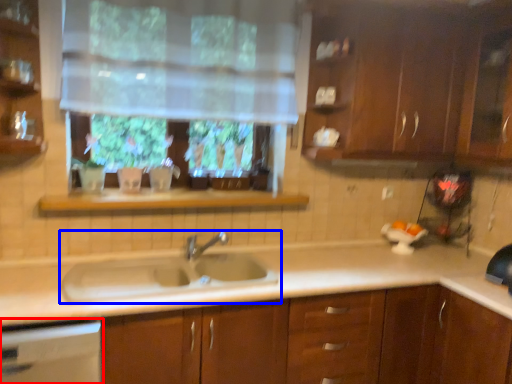
Question: Which object is closer to the camera taking this photo, dish washer (highlighted by a red box) or sink (highlighted by a blue box)?

Choices:
 (A) dish washer
 (B) sink

Answer: (A)